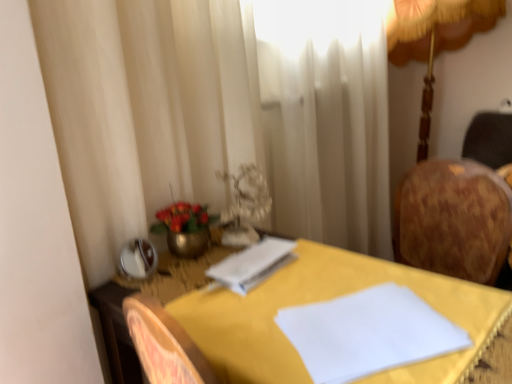
Identify the location of vacant area that lies in front of white paper at center. (260, 307).